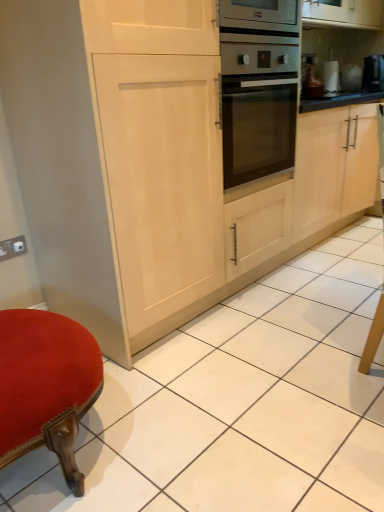
Question: Is black glossy coffee maker at upper right positioned before matte white electric outlet at lower left?

Choices:
 (A) no
 (B) yes

Answer: (A)

Question: Could you tell me if black glossy coffee maker at upper right is turned towards matte white electric outlet at lower left?

Choices:
 (A) yes
 (B) no

Answer: (B)

Question: Can you confirm if black glossy coffee maker at upper right is bigger than matte white electric outlet at lower left?

Choices:
 (A) no
 (B) yes

Answer: (B)

Question: Is matte white electric outlet at lower left located within black glossy coffee maker at upper right?

Choices:
 (A) no
 (B) yes

Answer: (A)

Question: Is black glossy coffee maker at upper right turned away from matte white electric outlet at lower left?

Choices:
 (A) no
 (B) yes

Answer: (A)

Question: Can you confirm if black glossy coffee maker at upper right is wider than matte white electric outlet at lower left?

Choices:
 (A) yes
 (B) no

Answer: (A)

Question: Can you confirm if matte white electric outlet at lower left is shorter than black glossy coffee maker at upper right?

Choices:
 (A) yes
 (B) no

Answer: (A)

Question: Are matte white electric outlet at lower left and black glossy coffee maker at upper right making contact?

Choices:
 (A) no
 (B) yes

Answer: (A)

Question: Can you confirm if matte white electric outlet at lower left is taller than black glossy coffee maker at upper right?

Choices:
 (A) yes
 (B) no

Answer: (B)

Question: From a real-world perspective, is matte white electric outlet at lower left on black glossy coffee maker at upper right?

Choices:
 (A) no
 (B) yes

Answer: (A)

Question: From a real-world perspective, is matte white electric outlet at lower left located beneath black glossy coffee maker at upper right?

Choices:
 (A) yes
 (B) no

Answer: (A)

Question: Would you consider matte white electric outlet at lower left to be distant from black glossy coffee maker at upper right?

Choices:
 (A) no
 (B) yes

Answer: (B)

Question: In the image, is matte white electric outlet at lower left on the left side or the right side of black glossy coffee maker at upper right?

Choices:
 (A) right
 (B) left

Answer: (B)